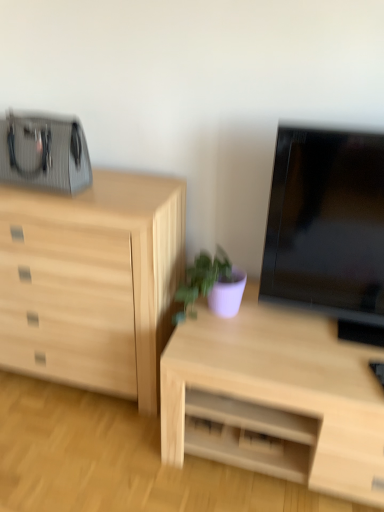
What do you see at coordinates (211, 286) in the screenshot? The height and width of the screenshot is (512, 384). I see `purple matte plant at center` at bounding box center [211, 286].

The width and height of the screenshot is (384, 512). What are the coordinates of `light wood desk at center` in the screenshot? It's located at [x=275, y=398].

Find the location of a particular element. This screenshot has width=384, height=512. television above the light wood desk at center (from the image's perspective) is located at coordinates (328, 228).

Which point is more distant from viewer, (354, 165) or (310, 338)?

The point (310, 338) is more distant.

Is black glossy tv at right in front of or behind light wood desk at center in the image?

Clearly, black glossy tv at right is in front of light wood desk at center.

Can you confirm if black glossy tv at right is thinner than light wood desk at center?

Correct, the width of black glossy tv at right is less than that of light wood desk at center.

Is natural wood chest of drawers at left looking in the opposite direction of light wood desk at center?

natural wood chest of drawers at left is not turned away from light wood desk at center.

From a real-world perspective, who is located higher, natural wood chest of drawers at left or light wood desk at center?

In real-world perspective, natural wood chest of drawers at left is above.

How many degrees apart are the facing directions of natural wood chest of drawers at left and light wood desk at center?

0.000213 degrees.

From a real-world perspective, which is physically below, purple matte plant at center or light wood desk at center?

From a 3D spatial view, light wood desk at center is below.

Considering the relative sizes of purple matte plant at center and light wood desk at center in the image provided, is purple matte plant at center bigger than light wood desk at center?

Actually, purple matte plant at center might be smaller than light wood desk at center.

Image resolution: width=384 pixels, height=512 pixels. In order to click on desk in front of the purple matte plant at center in this screenshot , I will do `click(275, 398)`.

From the image's perspective, is purple matte plant at center under light wood desk at center?

No, from the image's perspective, purple matte plant at center is not below light wood desk at center.

Would you say black glossy tv at right is inside or outside natural wood chest of drawers at left?

The correct answer is: outside.

I want to click on the chest of drawers below the black glossy tv at right (from the image's perspective), so click(92, 281).

Is point (298, 284) closer or farther from the camera than point (116, 327)?

Clearly, point (298, 284) is closer to the camera than point (116, 327).

From the picture: Measure the distance between black glossy tv at right and natural wood chest of drawers at left.

A distance of 23.93 inches exists between black glossy tv at right and natural wood chest of drawers at left.

Consider the image. Can you confirm if light wood desk at center is thinner than purple matte plant at center?

No.

Who is more distant, light wood desk at center or purple matte plant at center?

purple matte plant at center is behind.

Does light wood desk at center have a greater height compared to purple matte plant at center?

Yes.

From a real-world perspective, is purple matte plant at center positioned over natural wood chest of drawers at left based on gravity?

Yes, from a real-world perspective, purple matte plant at center is above natural wood chest of drawers at left.

Is purple matte plant at center wider than natural wood chest of drawers at left?

No.

Is purple matte plant at center closer to the viewer compared to natural wood chest of drawers at left?

No, it is behind natural wood chest of drawers at left.

From the image's perspective, which object appears higher, purple matte plant at center or natural wood chest of drawers at left?

natural wood chest of drawers at left, from the image's perspective.

Is purple matte plant at center a part of natural wood chest of drawers at left?

That's incorrect, purple matte plant at center is not inside natural wood chest of drawers at left.

From the image's perspective, who appears lower, natural wood chest of drawers at left or purple matte plant at center?

From the image's view, purple matte plant at center is below.

Does natural wood chest of drawers at left turn towards purple matte plant at center?

No, natural wood chest of drawers at left is not oriented towards purple matte plant at center.

This screenshot has width=384, height=512. Identify the location of television above the light wood desk at center (from the image's perspective). (328, 228).

You are a GUI agent. You are given a task and a screenshot of the screen. Output one action in this format:
    pyautogui.click(x=<x>, y=<y>)
    Task: Click on the chest of drawers on the left side of light wood desk at center
    This screenshot has height=512, width=384.
    Given the screenshot: What is the action you would take?
    pyautogui.click(x=92, y=281)

Based on their spatial positions, is light wood desk at center or black glossy tv at right closer to purple matte plant at center?

light wood desk at center lies closer to purple matte plant at center than the other object.

Which object lies nearer to the anchor point purple matte plant at center, natural wood chest of drawers at left or black glossy tv at right?

The object closer to purple matte plant at center is black glossy tv at right.

Considering their positions, is light wood desk at center positioned closer to black glossy tv at right than natural wood chest of drawers at left?

Based on the image, light wood desk at center appears to be nearer to black glossy tv at right.

From the image, which object appears to be nearer to natural wood chest of drawers at left, purple matte plant at center or light wood desk at center?

purple matte plant at center is closer to natural wood chest of drawers at left.

Looking at this image, considering their positions, is light wood desk at center positioned further to natural wood chest of drawers at left than purple matte plant at center?

Based on the image, light wood desk at center appears to be further to natural wood chest of drawers at left.

Which object lies nearer to the anchor point black glossy tv at right, natural wood chest of drawers at left or purple matte plant at center?

purple matte plant at center.

From the image, which object appears to be farther from black glossy tv at right, natural wood chest of drawers at left or light wood desk at center?

Among the two, natural wood chest of drawers at left is located further to black glossy tv at right.

Based on their spatial positions, is black glossy tv at right or light wood desk at center closer to purple matte plant at center?

light wood desk at center is closer to purple matte plant at center.

This screenshot has width=384, height=512. Identify the location of houseplant between natural wood chest of drawers at left and light wood desk at center from left to right. (211, 286).

Where is `desk between natural wood chest of drawers at left and black glossy tv at right in the horizontal direction`? This screenshot has width=384, height=512. desk between natural wood chest of drawers at left and black glossy tv at right in the horizontal direction is located at coordinates 275,398.

Find the location of a particular element. houseplant located between natural wood chest of drawers at left and black glossy tv at right in the left-right direction is located at coordinates (211, 286).

The image size is (384, 512). Identify the location of houseplant between black glossy tv at right and light wood desk at center from top to bottom. (211, 286).